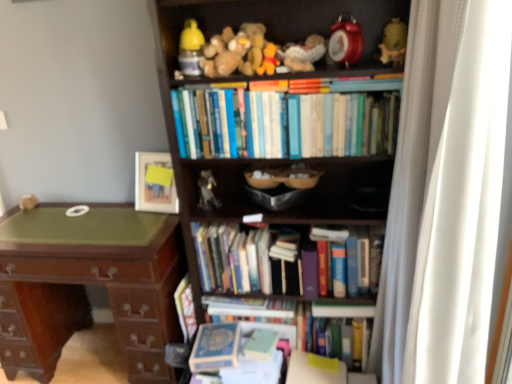
Locate an element on the screen. vacant position to the left of matte wooden picture frame at upper center is located at coordinates (124, 213).